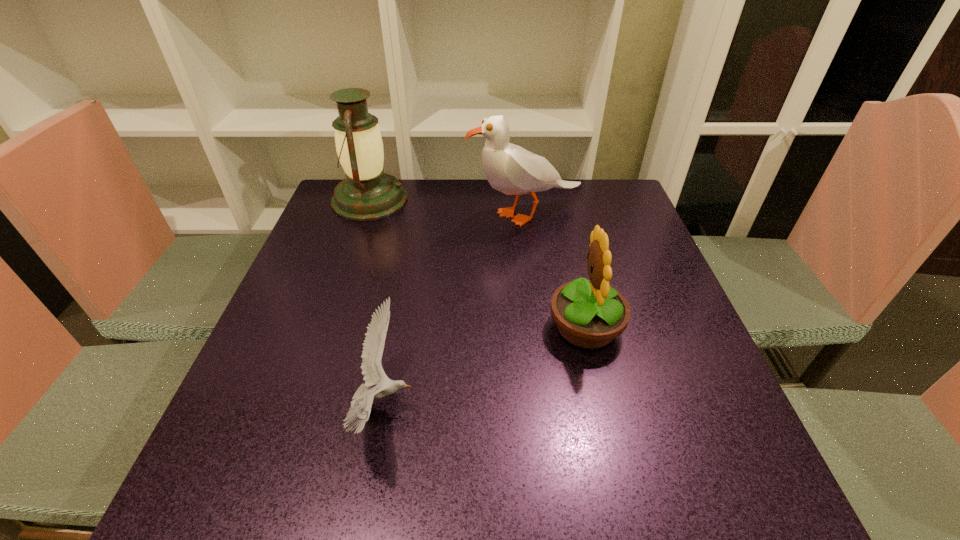
Find the location of a particular element. object located at the far left corner is located at coordinates (367, 193).

The height and width of the screenshot is (540, 960). What are the coordinates of `object that is at the far right corner` in the screenshot? It's located at (509, 168).

This screenshot has width=960, height=540. I want to click on vacant area at the far edge, so click(x=451, y=198).

Locate an element on the screen. The height and width of the screenshot is (540, 960). vacant space at the near edge of the desktop is located at coordinates 490,458.

In the image, there is a desktop. Where is `blank space at the left edge`? The height and width of the screenshot is (540, 960). blank space at the left edge is located at coordinates (297, 353).

This screenshot has width=960, height=540. Find the location of `vacant point at the right edge`. vacant point at the right edge is located at coordinates (671, 342).

Locate an element on the screen. free region at the far left corner is located at coordinates (332, 210).

At what (x,y) coordinates should I click in order to perform the action: click on blank area at the far right corner. Please return your answer as a coordinate pair (x, y). Looking at the image, I should click on (586, 205).

At what (x,y) coordinates should I click in order to perform the action: click on empty location between the shorter gull and the second shortest object. Please return your answer as a coordinate pair (x, y). Looking at the image, I should click on (484, 366).

The width and height of the screenshot is (960, 540). Identify the location of free spot between the farther gull and the sunflower. (555, 271).